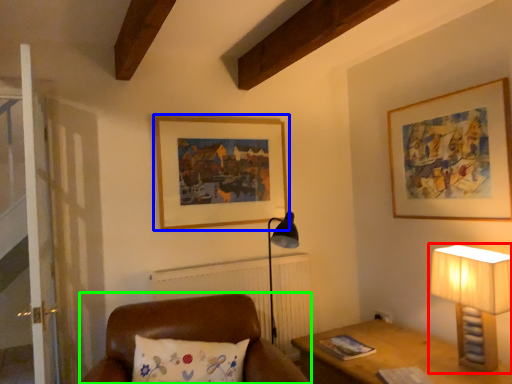
Question: Which is farther away from lamp (highlighted by a red box)? picture frame (highlighted by a blue box) or furniture (highlighted by a green box)?

Choices:
 (A) picture frame
 (B) furniture

Answer: (A)